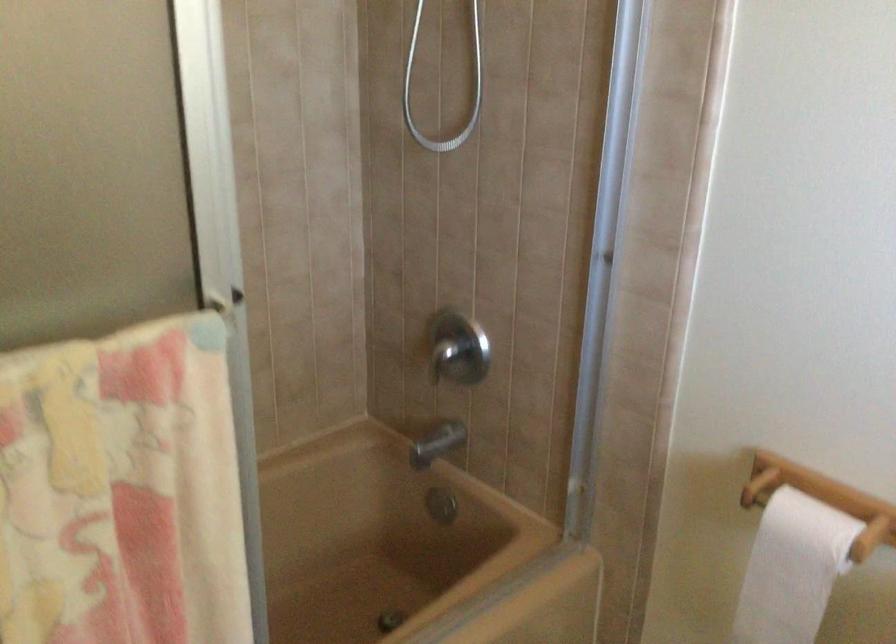
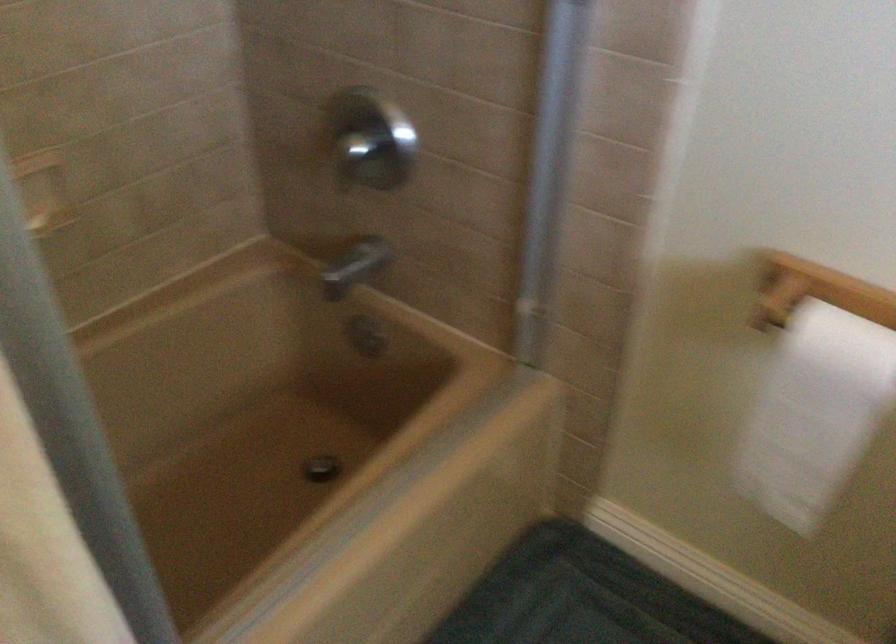
Question: How did the camera likely rotate?

Choices:
 (A) Left
 (B) Right
 (C) Up
 (D) Down

Answer: (D)